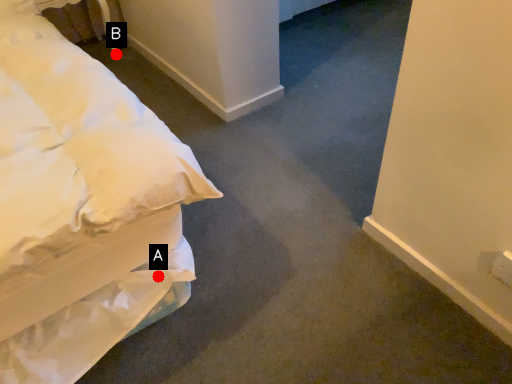
Question: Two points are circled on the image, labeled by A and B beside each circle. Which point is farther from the camera taking this photo?

Choices:
 (A) A is further
 (B) B is further

Answer: (B)